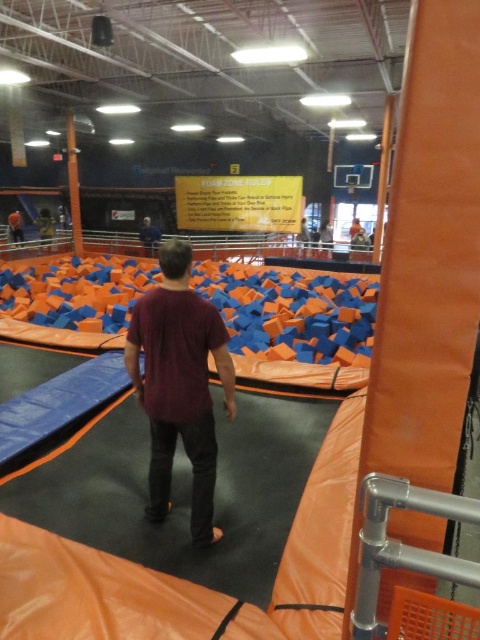
Question: Does maroon t-shirt at center have a larger size compared to maroon fabric shirt at center?

Choices:
 (A) yes
 (B) no

Answer: (A)

Question: Does maroon t-shirt at center appear over maroon fabric shirt at center?

Choices:
 (A) yes
 (B) no

Answer: (B)

Question: Is maroon t-shirt at center in front of maroon fabric shirt at center?

Choices:
 (A) no
 (B) yes

Answer: (B)